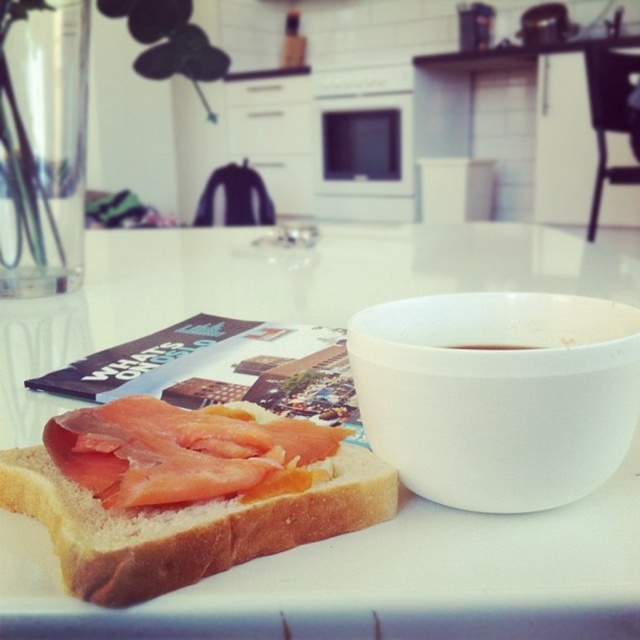
You are setting up a small table for a morning coffee. You have a white glossy table at center and a brown matte bowl at right. Where should you place the bowl relative to the table to match the scene?

The brown matte bowl at right should be placed to the right of the white glossy table at center as the description states the white glossy table at center is to the left of the brown matte bowl at right.

You are setting up a breakfast table and want to place a decorative plate between the pinkish salmon at center and the white matte bowl at upper right. Which object should the plate be closer to if it needs to be placed equidistant from both?

The plate should be closer to the white matte bowl at upper right because the pinkish salmon at center is wider than the white matte bowl at upper right, requiring more space between them to maintain equal distance.